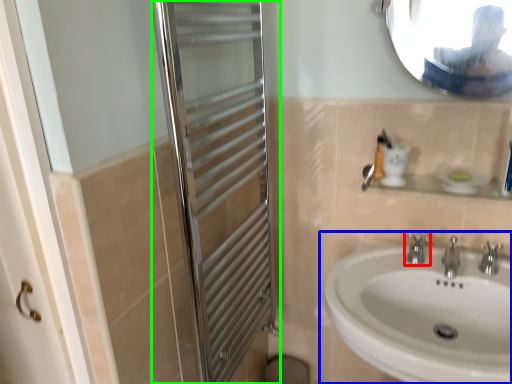
Question: Which object is the closest to the tap (highlighted by a red box)? Choose among these: sink (highlighted by a blue box) or screen door (highlighted by a green box).

Choices:
 (A) sink
 (B) screen door

Answer: (A)